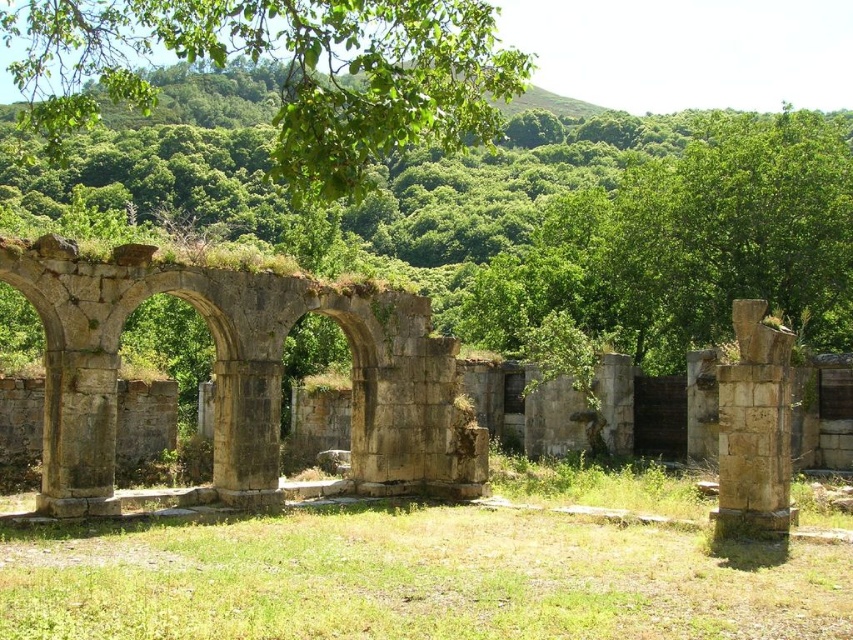
Question: Which of the following is the closest to the observer?

Choices:
 (A) stone column at right
 (B) green leafy tree at center
 (C) green leafy tree at upper center

Answer: (C)

Question: Which is farther from the stone column at right?

Choices:
 (A) green leafy tree at upper center
 (B) stone arches at center

Answer: (A)

Question: Does stone arches at center have a greater width compared to stone column at right?

Choices:
 (A) no
 (B) yes

Answer: (B)

Question: Is green leafy tree at upper center below stone column at right?

Choices:
 (A) no
 (B) yes

Answer: (A)

Question: Which point is closer to the camera taking this photo?

Choices:
 (A) (735, 310)
 (B) (401, 72)

Answer: (B)

Question: Is stone arches at center in front of green leafy tree at upper center?

Choices:
 (A) yes
 (B) no

Answer: (B)